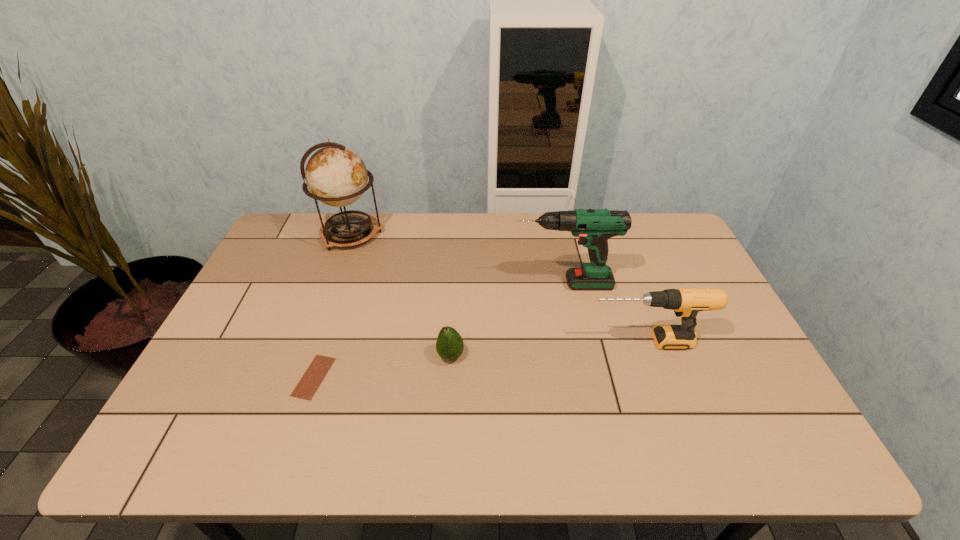
At what (x,y) coordinates should I click in order to perform the action: click on free spot between the shorter drill and the second tallest object. Please return your answer as a coordinate pair (x, y). The height and width of the screenshot is (540, 960). Looking at the image, I should click on (604, 313).

The image size is (960, 540). Identify the location of vacant space in between the shortest object and the third object from right to left. (382, 367).

Locate an element on the screen. This screenshot has height=540, width=960. empty space between the farthest object and the chocolate bar is located at coordinates (333, 306).

Locate an element on the screen. The image size is (960, 540). vacant space that's between the second farthest object and the third tallest object is located at coordinates (604, 313).

This screenshot has height=540, width=960. I want to click on free space between the third object from left to right and the fourth shortest object, so click(x=507, y=320).

Locate an element on the screen. The image size is (960, 540). empty space between the third shortest object and the farthest object is located at coordinates (499, 288).

Image resolution: width=960 pixels, height=540 pixels. I want to click on free spot between the second shortest object and the farthest object, so click(x=401, y=295).

Image resolution: width=960 pixels, height=540 pixels. I want to click on object that stands as the third closest to the nearer drill, so click(x=307, y=386).

The image size is (960, 540). I want to click on the fourth closest object relative to the farthest object, so click(x=686, y=302).

Where is `free location that satisfies the following two spatial constraints: 1. at the center of the fourth tallest object; 2. on the right side of the farthest object`? This screenshot has height=540, width=960. free location that satisfies the following two spatial constraints: 1. at the center of the fourth tallest object; 2. on the right side of the farthest object is located at coordinates (307, 356).